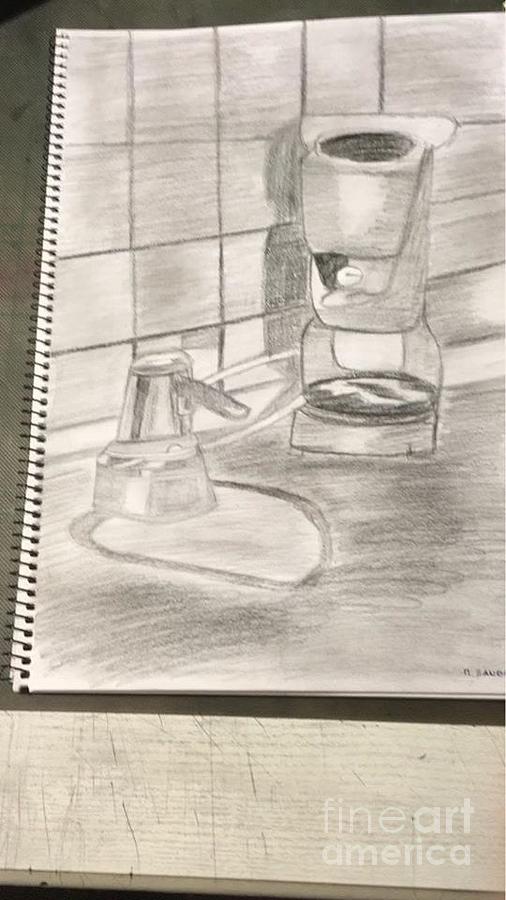
Locate an element on the screen. Image resolution: width=506 pixels, height=900 pixels. tiled wall is located at coordinates (200, 176), (472, 205).